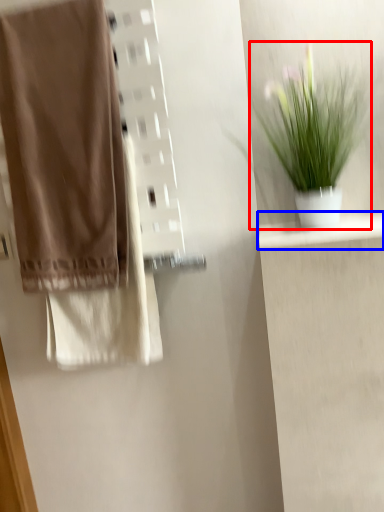
Question: Which point is further to the camera, houseplant (highlighted by a red box) or shelf (highlighted by a blue box)?

Choices:
 (A) houseplant
 (B) shelf

Answer: (B)